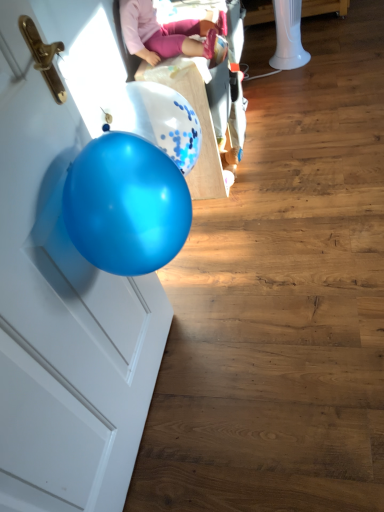
Question: Considering the relative sizes of glossy blue balloon at left and white plastic baby carriage at upper center in the image provided, is glossy blue balloon at left shorter than white plastic baby carriage at upper center?

Choices:
 (A) yes
 (B) no

Answer: (B)

Question: Is glossy blue balloon at left not near white plastic baby carriage at upper center?

Choices:
 (A) yes
 (B) no

Answer: (B)

Question: Is glossy blue balloon at left positioned with its back to white plastic baby carriage at upper center?

Choices:
 (A) no
 (B) yes

Answer: (A)

Question: From the image's perspective, is glossy blue balloon at left on top of white plastic baby carriage at upper center?

Choices:
 (A) yes
 (B) no

Answer: (B)

Question: Is glossy blue balloon at left next to white plastic baby carriage at upper center and touching it?

Choices:
 (A) yes
 (B) no

Answer: (B)

Question: From the image's perspective, is pink fabric doll at upper center above or below glossy blue balloon at left?

Choices:
 (A) below
 (B) above

Answer: (B)

Question: From a real-world perspective, is pink fabric doll at upper center physically located above or below glossy blue balloon at left?

Choices:
 (A) above
 (B) below

Answer: (A)

Question: Does point (132, 2) appear closer or farther from the camera than point (109, 476)?

Choices:
 (A) farther
 (B) closer

Answer: (A)

Question: Is pink fabric doll at upper center inside or outside of glossy blue balloon at left?

Choices:
 (A) outside
 (B) inside

Answer: (A)

Question: From a real-world perspective, is white plastic baby carriage at upper center above or below pink fabric doll at upper center?

Choices:
 (A) above
 (B) below

Answer: (B)

Question: Is white plastic baby carriage at upper center bigger or smaller than pink fabric doll at upper center?

Choices:
 (A) big
 (B) small

Answer: (A)

Question: Considering the positions of white plastic baby carriage at upper center and pink fabric doll at upper center in the image, is white plastic baby carriage at upper center taller or shorter than pink fabric doll at upper center?

Choices:
 (A) short
 (B) tall

Answer: (B)

Question: Is white plastic baby carriage at upper center inside or outside of pink fabric doll at upper center?

Choices:
 (A) outside
 (B) inside

Answer: (A)

Question: In the image, is glossy blue balloon at left on the left side or the right side of pink fabric doll at upper center?

Choices:
 (A) right
 (B) left

Answer: (B)

Question: Is glossy blue balloon at left situated inside pink fabric doll at upper center or outside?

Choices:
 (A) inside
 (B) outside

Answer: (B)